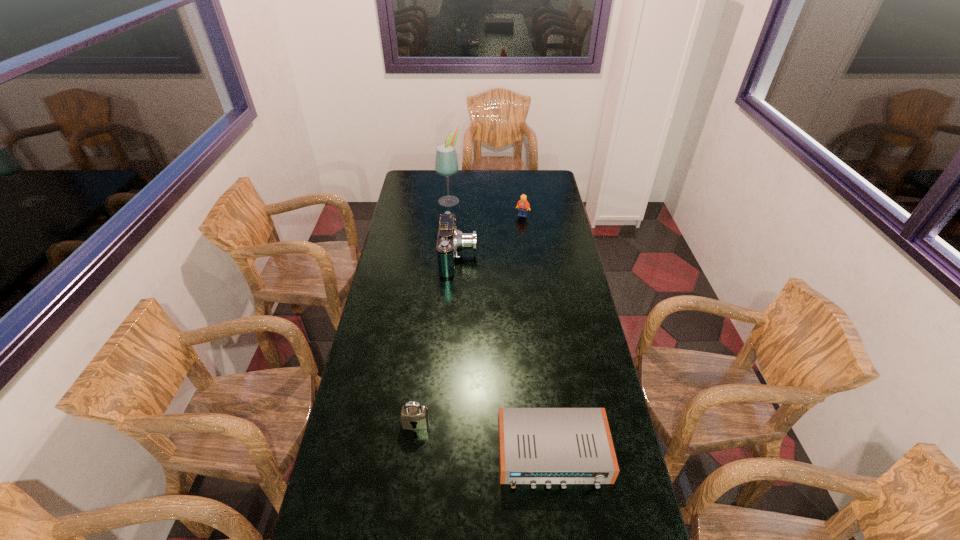
Find the location of `blank region between the tallest object and the Lego`. blank region between the tallest object and the Lego is located at coordinates (486, 208).

Where is `unoccupied position between the second tallest object and the radio receiver`? unoccupied position between the second tallest object and the radio receiver is located at coordinates (506, 356).

At what (x,y) coordinates should I click in order to perform the action: click on free space between the padlock and the camcorder. Please return your answer as a coordinate pair (x, y). The image size is (960, 540). Looking at the image, I should click on (438, 341).

Identify which object is the second closest to the fourth shortest object. Please provide its 2D coordinates. Your answer should be formatted as a tuple, i.e. [(x, y)], where the tuple contains the x and y coordinates of a point satisfying the conditions above.

[(446, 163)]

The image size is (960, 540). Find the location of `object that is the closest to the fourth shortest object`. object that is the closest to the fourth shortest object is located at coordinates (522, 205).

In order to click on blank area in the image that satisfies the following two spatial constraints: 1. on the front-facing side of the second farthest object; 2. on the front-facing side of the camcorder in this screenshot , I will do `click(528, 258)`.

The image size is (960, 540). Identify the location of free location that satisfies the following two spatial constraints: 1. on the front-facing side of the second tallest object; 2. at the front of the padlock near the keyhole. (450, 423).